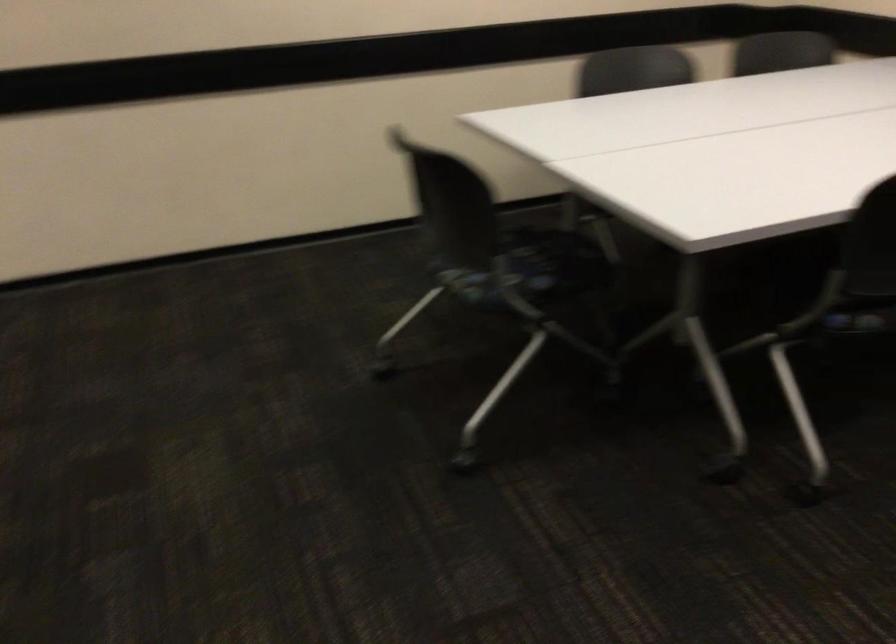
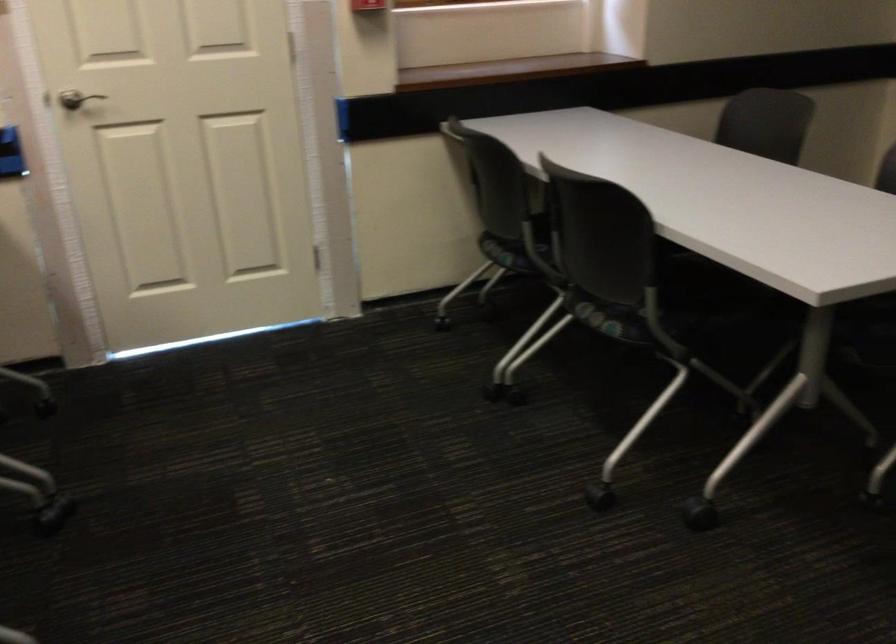
The images are taken continuously from a first-person perspective. In which direction is your viewpoint rotating?

The camera's rotation is toward right-down.